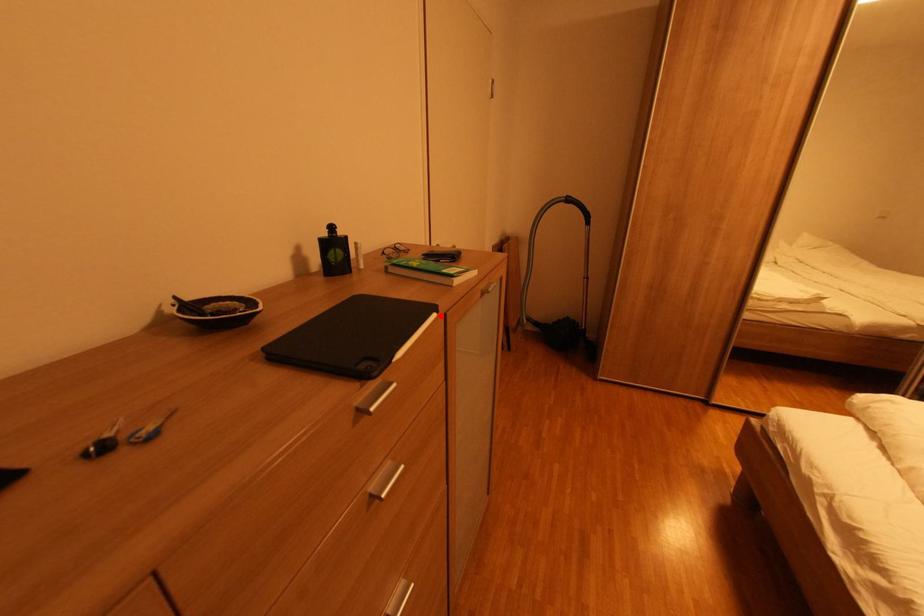
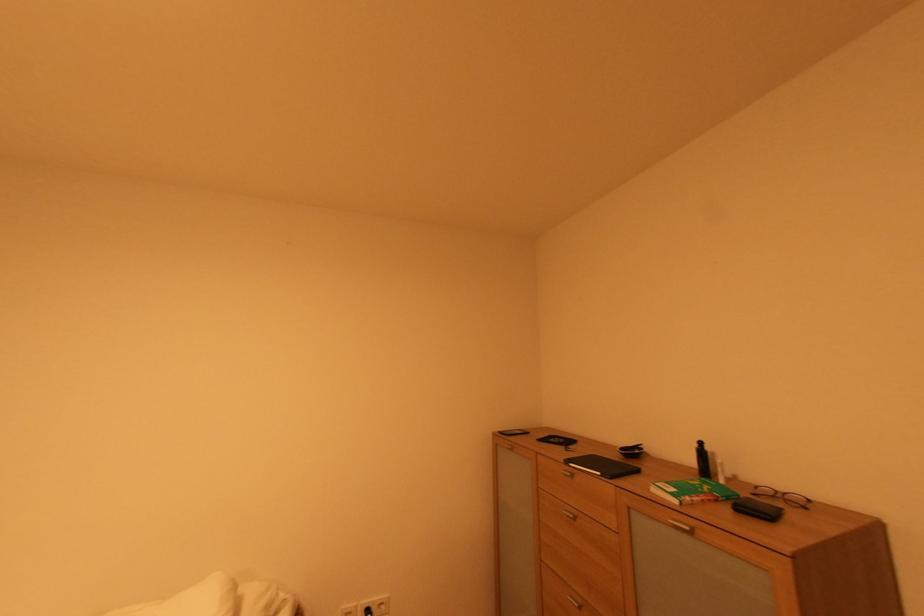
Locate, in the second image, the point that corresponds to the highlighted location in the first image.

(604, 475)